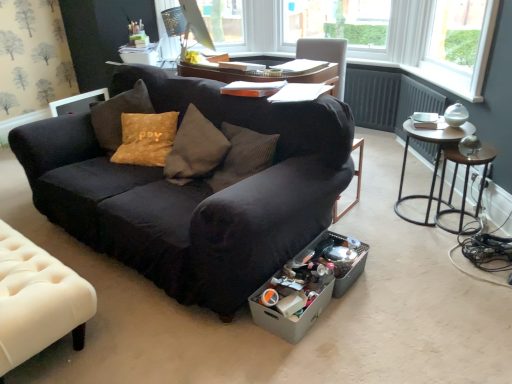
Locate an element on the screen. vacant region above gray cardboard box at lower center (from a real-world perspective) is located at coordinates (285, 291).